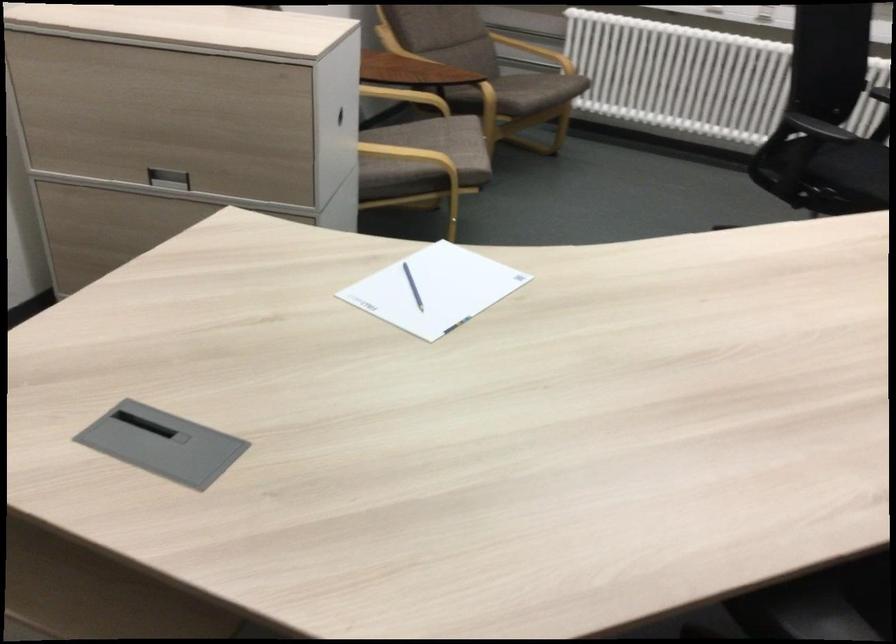
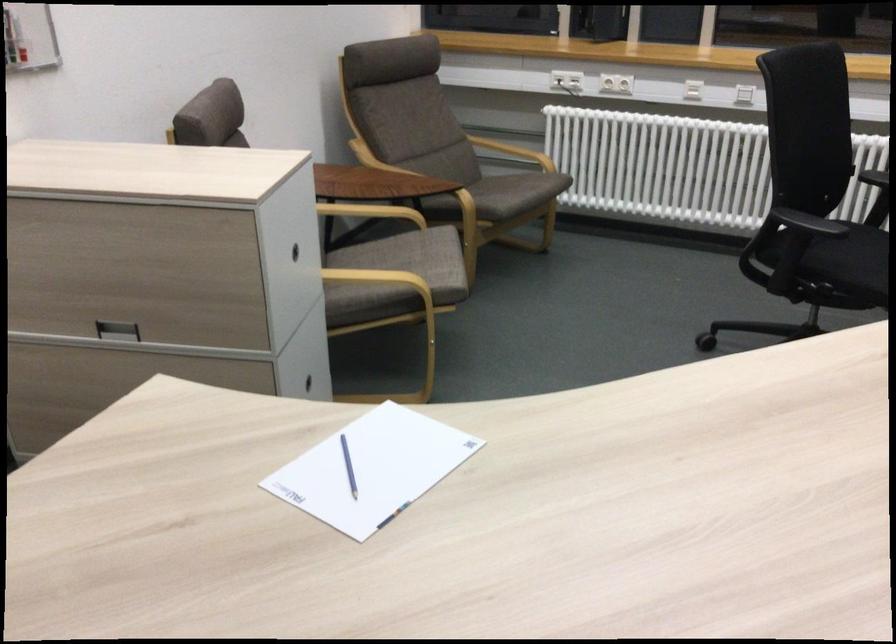
In the second image, find the point that corresponds to (x=166, y=180) in the first image.

(116, 330)